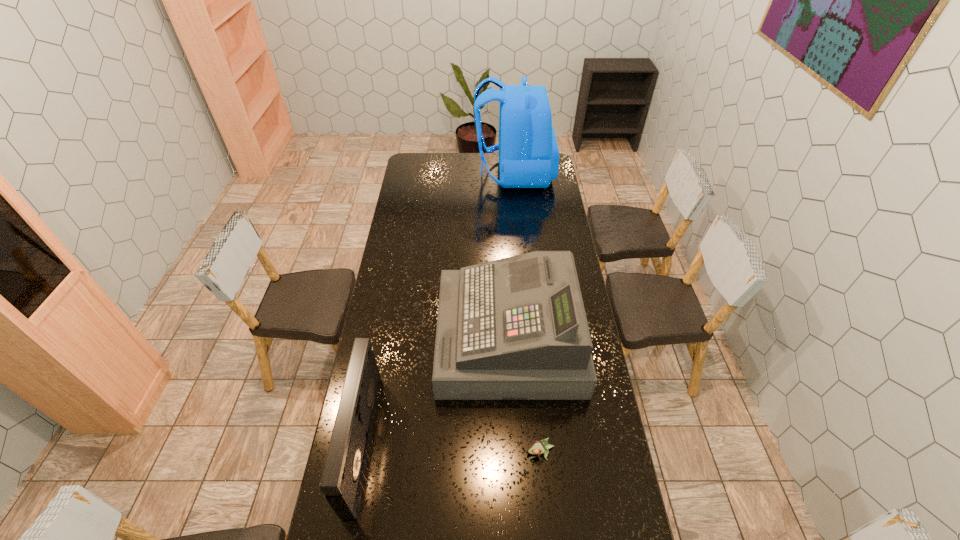
Where is `free region located 0.060m on the front-facing side of the cash register`? The width and height of the screenshot is (960, 540). free region located 0.060m on the front-facing side of the cash register is located at coordinates (424, 339).

Identify the location of free region located 0.100m on the front-facing side of the cash register. The width and height of the screenshot is (960, 540). (x=415, y=339).

Locate an element on the screen. The image size is (960, 540). vacant region located 0.120m on the front side of the second shortest object is located at coordinates (406, 442).

This screenshot has width=960, height=540. What are the coordinates of `vacant point located 0.180m on the seed side of the shortest object` in the screenshot? It's located at tap(547, 521).

In order to click on object positioned at the far edge in this screenshot , I will do `click(528, 151)`.

Locate an element on the screen. object that is at the left edge is located at coordinates 343,473.

The width and height of the screenshot is (960, 540). I want to click on backpack that is positioned at the right edge, so click(x=528, y=151).

Locate an element on the screen. This screenshot has height=540, width=960. cash register that is at the right edge is located at coordinates (515, 328).

Identify the location of object positioned at the far right corner. (528, 151).

The width and height of the screenshot is (960, 540). In the image, there is a desktop. Identify the location of blank space at the left edge. (410, 294).